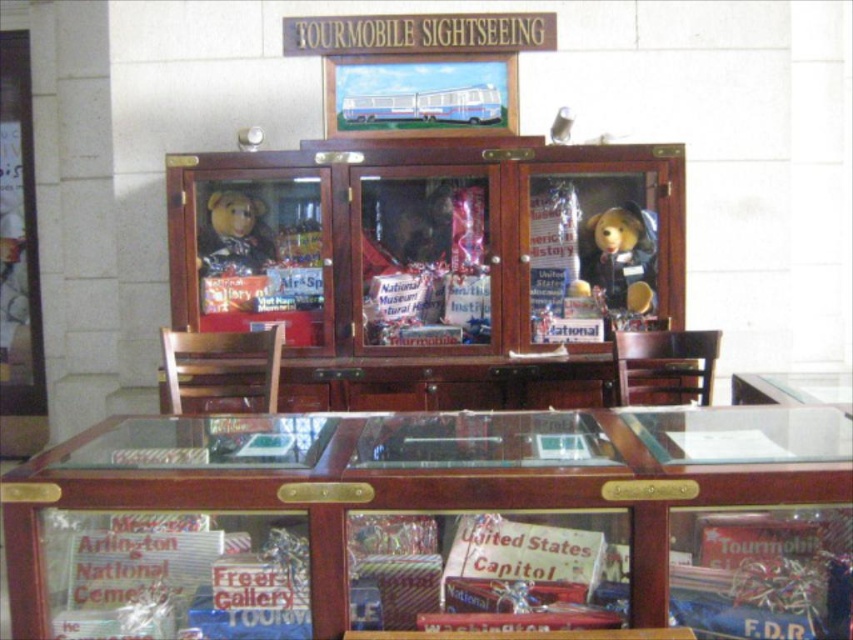
Question: Which point is farther to the camera?

Choices:
 (A) matte brown teddy bear at right
 (B) matte brown teddy bear at left

Answer: (A)

Question: Is matte brown teddy bear at right positioned in front of matte brown teddy bear at left?

Choices:
 (A) no
 (B) yes

Answer: (A)

Question: Considering the relative positions of matte brown teddy bear at right and matte brown teddy bear at left in the image provided, where is matte brown teddy bear at right located with respect to matte brown teddy bear at left?

Choices:
 (A) below
 (B) above

Answer: (A)

Question: Which object appears closest to the camera in this image?

Choices:
 (A) matte brown teddy bear at left
 (B) matte brown teddy bear at right

Answer: (A)

Question: Can you confirm if matte brown teddy bear at right is wider than matte brown teddy bear at left?

Choices:
 (A) no
 (B) yes

Answer: (B)